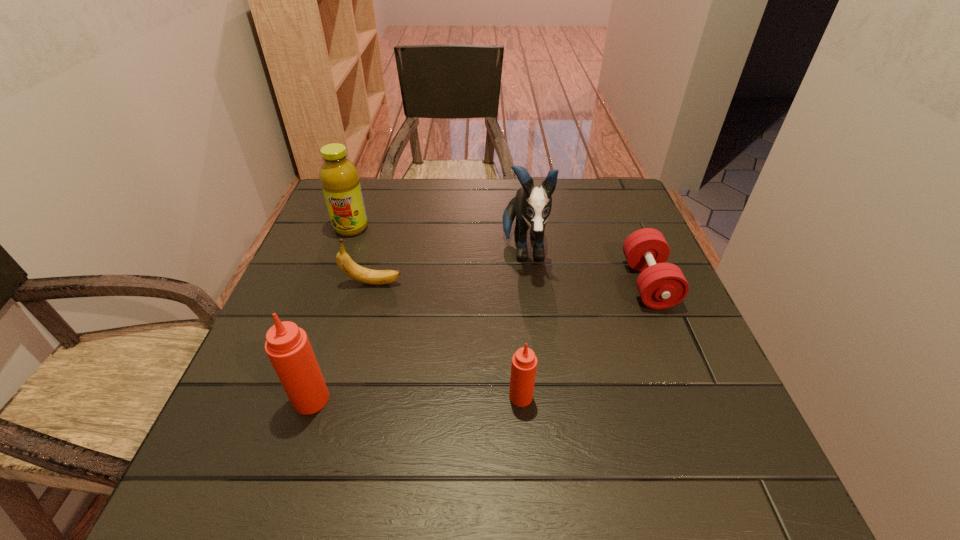
The image size is (960, 540). I want to click on object that is positioned at the near left corner, so click(288, 348).

Identify the location of free space at the far edge of the desktop. (439, 215).

In the image, there is a desktop. Where is `free space at the near edge`? free space at the near edge is located at coordinates (492, 408).

In the image, there is a desktop. Where is `vacant space at the left edge`? Image resolution: width=960 pixels, height=540 pixels. vacant space at the left edge is located at coordinates (329, 333).

Image resolution: width=960 pixels, height=540 pixels. What are the coordinates of `vacant space at the right edge of the desktop` in the screenshot? It's located at (631, 337).

In the image, there is a desktop. Where is `vacant space at the far left corner`? The image size is (960, 540). vacant space at the far left corner is located at coordinates (371, 197).

At what (x,y) coordinates should I click in order to perform the action: click on vacant space at the far right corner of the desktop. Please return your answer as a coordinate pair (x, y). This screenshot has height=540, width=960. Looking at the image, I should click on [578, 181].

Locate an element on the screen. The image size is (960, 540). vacant point located between the right Tabasco sauce and the fruit juice is located at coordinates (436, 312).

Locate an element on the screen. Image resolution: width=960 pixels, height=540 pixels. free space between the taller Tabasco sauce and the shortest object is located at coordinates click(480, 341).

Identify the location of vacant region between the shorter Tabasco sauce and the banana. (446, 340).